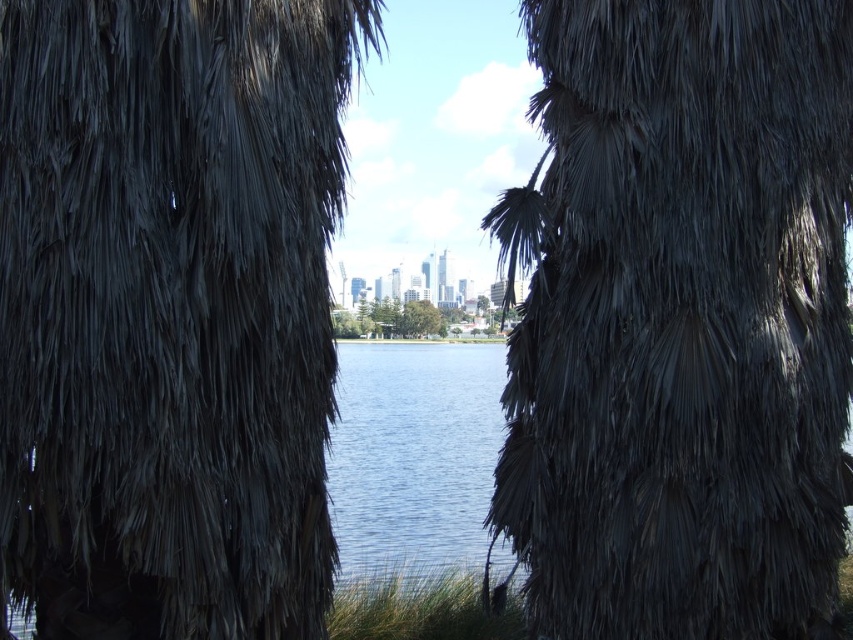
Question: Based on their relative distances, which object is farther from the dark gray textured palm tree at center?

Choices:
 (A) blue water at center
 (B) green leafy tree at center

Answer: (B)

Question: Is blue water at center wider than green leafy tree at center?

Choices:
 (A) no
 (B) yes

Answer: (B)

Question: Is blue water at center in front of green leafy tree at center?

Choices:
 (A) no
 (B) yes

Answer: (B)

Question: Estimate the real-world distances between objects in this image. Which object is closer to the dark brown textured palm tree at center?

Choices:
 (A) blue water at center
 (B) green leafy tree at center
 (C) dark gray textured palm tree at center

Answer: (A)

Question: Observing the image, what is the correct spatial positioning of dark gray textured palm tree at center in reference to blue water at center?

Choices:
 (A) above
 (B) below

Answer: (A)

Question: Which point appears closest to the camera in this image?

Choices:
 (A) (456, 497)
 (B) (6, 179)
 (C) (412, 308)
 (D) (772, 92)

Answer: (B)